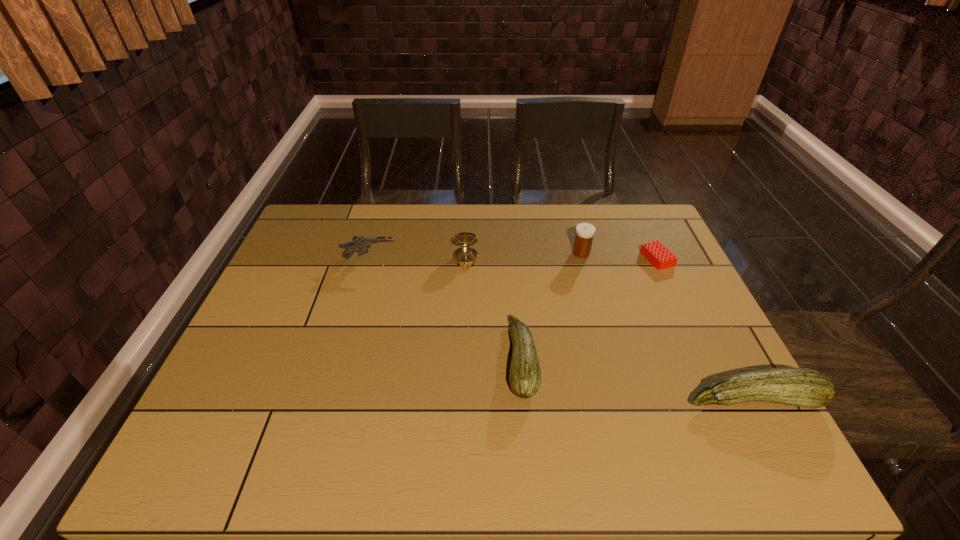
Please point a spot to add another zucchini on the left. Please provide its 2D coordinates. Your answer should be formatted as a tuple, i.e. [(x, y)], where the tuple contains the x and y coordinates of a point satisfying the conditions above.

[(323, 326)]